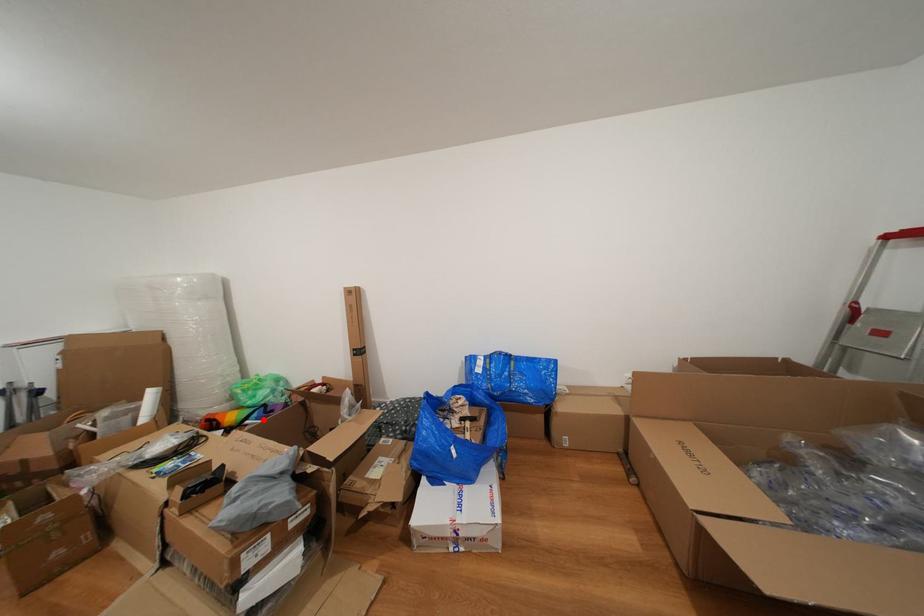
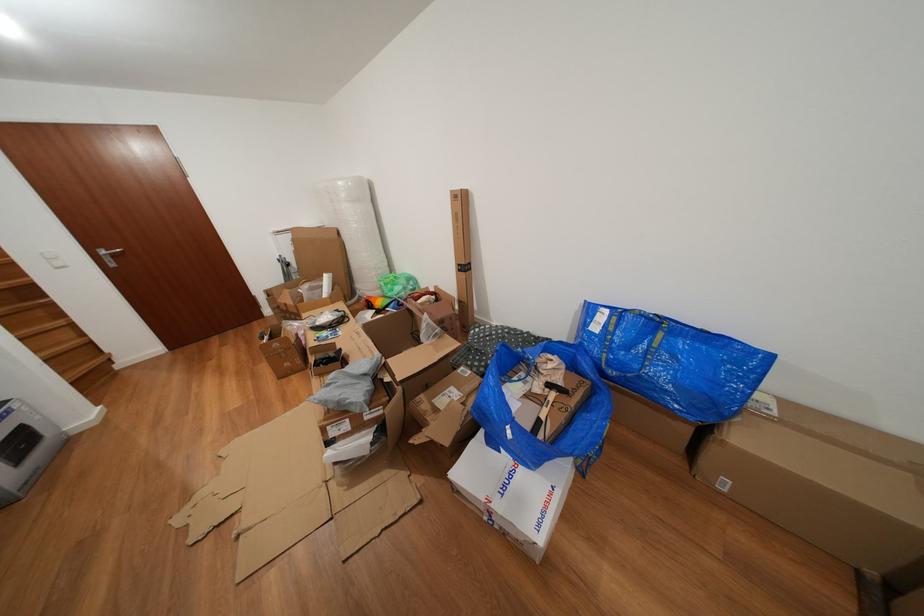
Question: A red point is marked in image1. In image2, is the corresponding 3D point closer to the camera or farther? Reply with the corresponding letter.

Choices:
 (A) The corresponding 3D point is closer.
 (B) The corresponding 3D point is farther.

Answer: (B)